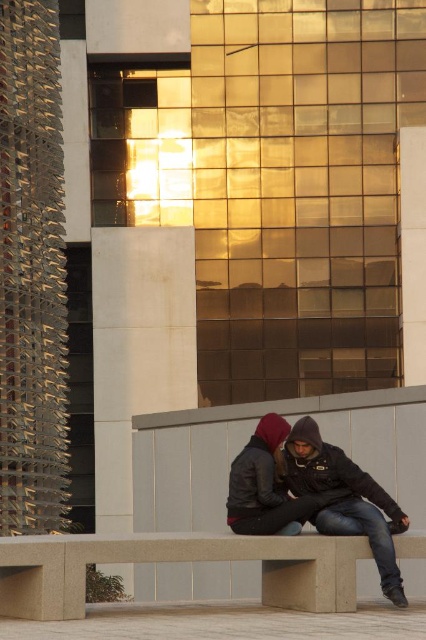
Question: Which of the following is the farthest from the observer?

Choices:
 (A) (333, 566)
 (B) (324, 470)
 (C) (250, 528)

Answer: (B)

Question: Does smooth concrete bench at center appear under matte black leather jacket at center?

Choices:
 (A) yes
 (B) no

Answer: (A)

Question: Which of the following is the farthest from the observer?

Choices:
 (A) matte black leather jacket at center
 (B) smooth concrete bench at center
 (C) dark gray hoodie at center

Answer: (A)

Question: Does smooth concrete bench at center lie behind dark gray hoodie at center?

Choices:
 (A) yes
 (B) no

Answer: (B)

Question: Based on their relative distances, which object is farther from the dark gray hoodie at center?

Choices:
 (A) matte black leather jacket at center
 (B) smooth concrete bench at center

Answer: (B)

Question: Is the position of smooth concrete bench at center less distant than that of dark gray hoodie at center?

Choices:
 (A) yes
 (B) no

Answer: (A)